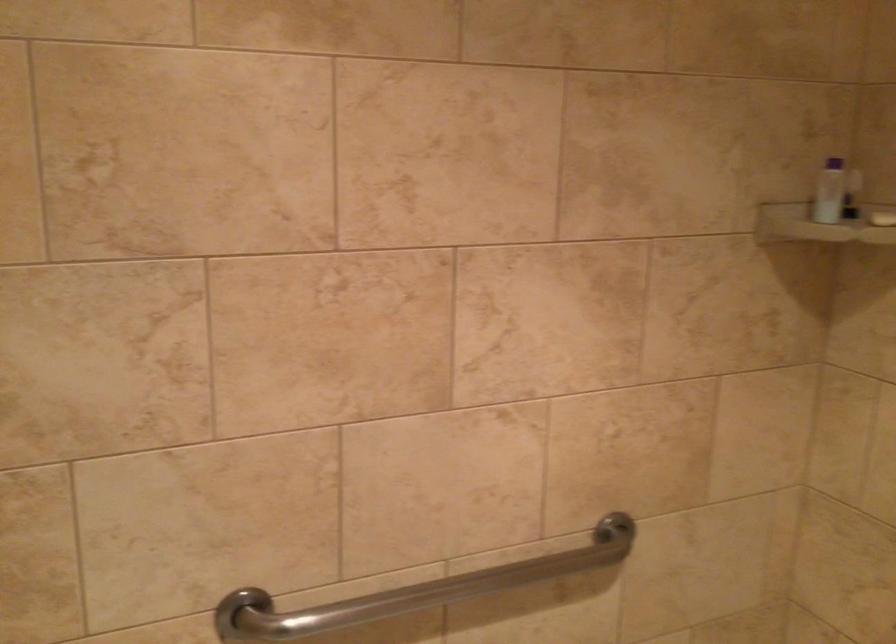
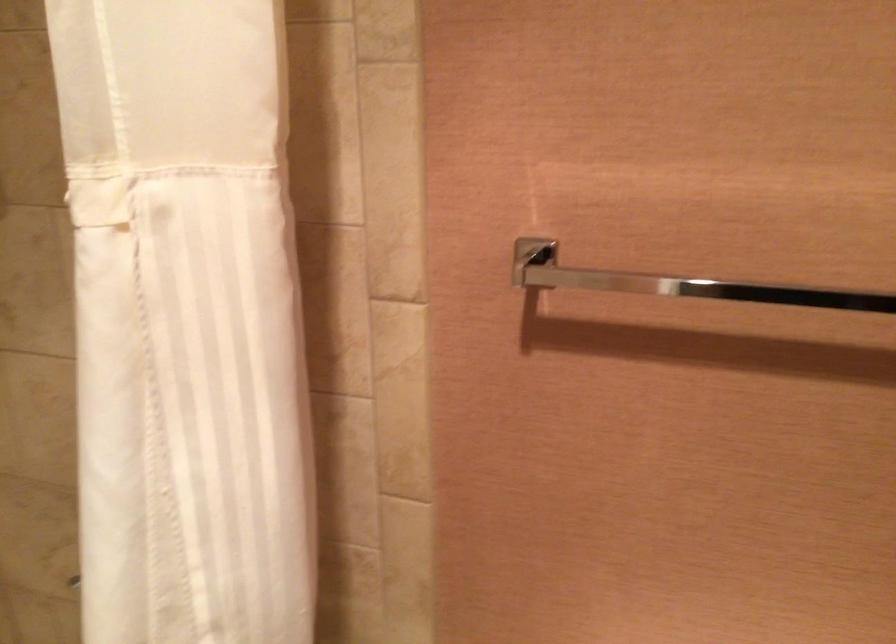
Question: Based on the continuous images, in which direction is the camera rotating? Reply with the corresponding letter.

Choices:
 (A) Left
 (B) Right
 (C) Up
 (D) Down

Answer: (B)